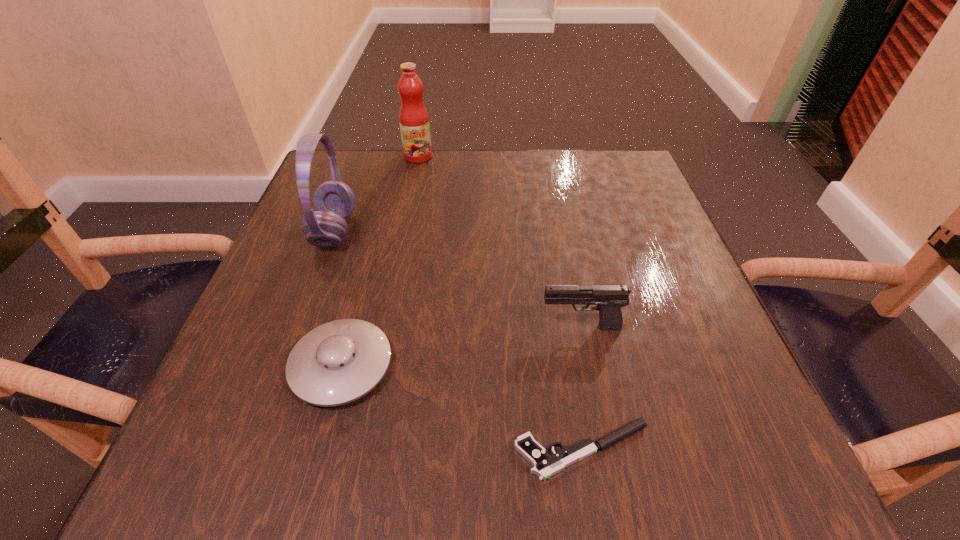
The image size is (960, 540). In order to click on blank space located 0.370m aim along the barrel of the taller pistol in this screenshot , I will do `click(315, 327)`.

At what (x,y) coordinates should I click in order to perform the action: click on vacant space located 0.070m aim along the barrel of the taller pistol. Please return your answer as a coordinate pair (x, y). The width and height of the screenshot is (960, 540). Looking at the image, I should click on (497, 327).

Locate an element on the screen. vacant space situated on the front of the saucer is located at coordinates (310, 486).

Where is `free spot located 0.330m on the front-facing side of the shorter pistol`? The image size is (960, 540). free spot located 0.330m on the front-facing side of the shorter pistol is located at coordinates (263, 450).

This screenshot has width=960, height=540. Find the location of `vacant space located 0.150m on the front-facing side of the shorter pistol`. vacant space located 0.150m on the front-facing side of the shorter pistol is located at coordinates (400, 450).

Identify the location of free space located on the front-facing side of the shorter pistol. (300, 450).

Identify the location of fruit juice that is at the far edge. (414, 120).

What are the coordinates of `headset at the far edge` in the screenshot? It's located at (334, 201).

Find the location of a particular element. object present at the near edge is located at coordinates (545, 466).

Where is `headset located at the left edge`? The height and width of the screenshot is (540, 960). headset located at the left edge is located at coordinates (334, 201).